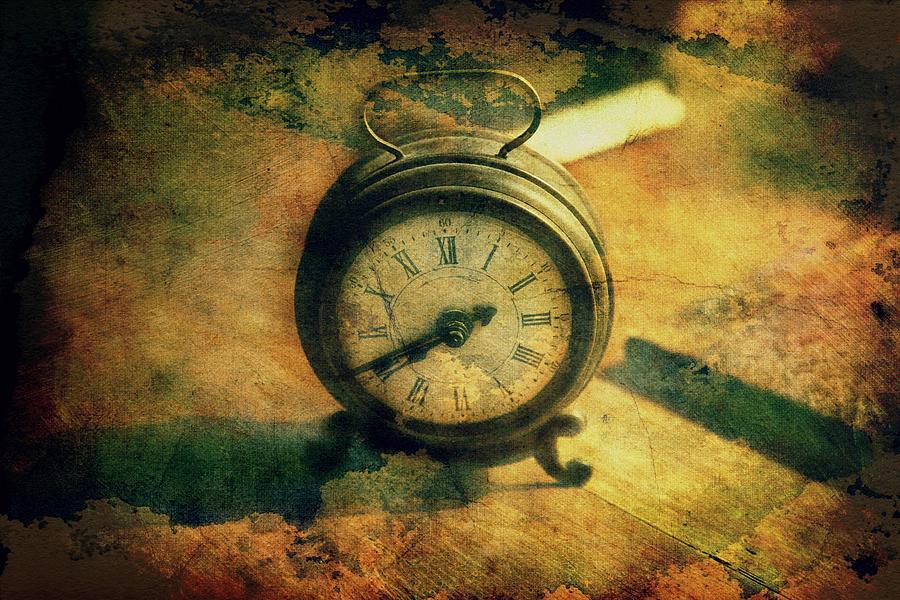
Locate an element on the screen. Image resolution: width=900 pixels, height=600 pixels. rear  leg of alarm clock is located at coordinates (577, 428).